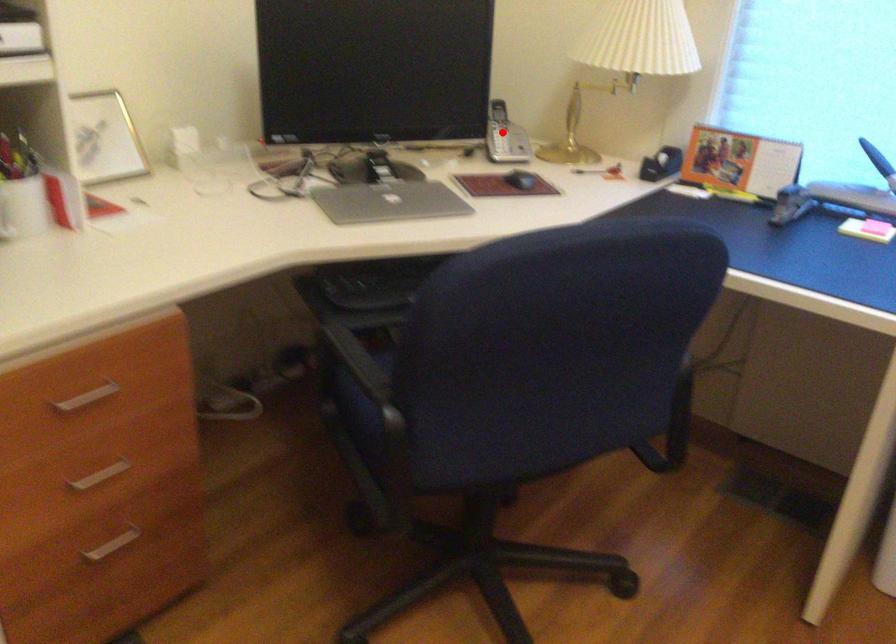
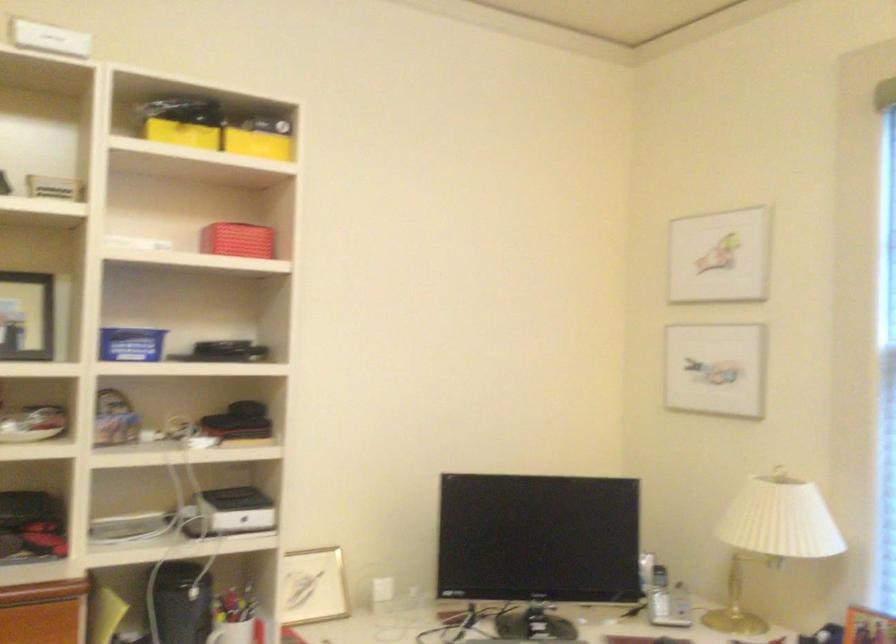
Find the pixel in the second image that matches the highlighted location in the first image.

(659, 594)